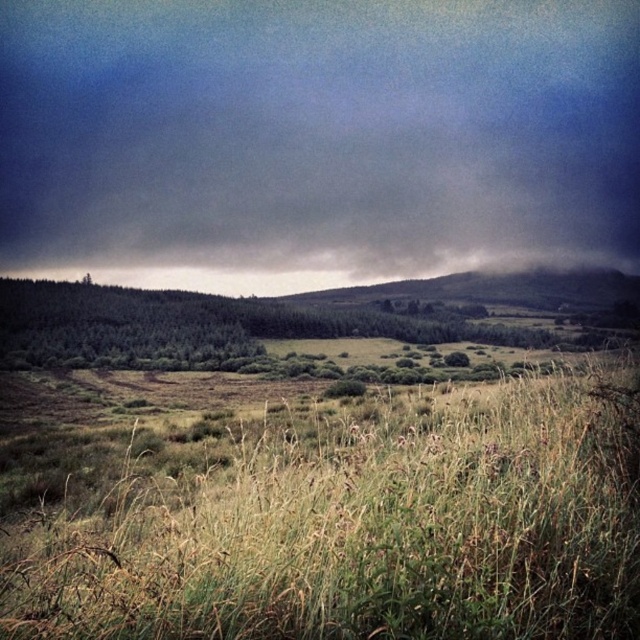
You are standing at the origin point in the landscape. You see two points marked in the image. Which point is closer to you, point at coordinates (484,3) or point at coordinates (548,397)?

Point at coordinates (548,397) is closer to you because point at coordinates (484,3) is behind it.

You are standing in the middle of the field of tall grasses and wildflowers in the foreground. You notice a point marked at coordinates (316, 138). What object is located at this point?

The dark gray cloud at upper center is located at the point marked (316, 138).